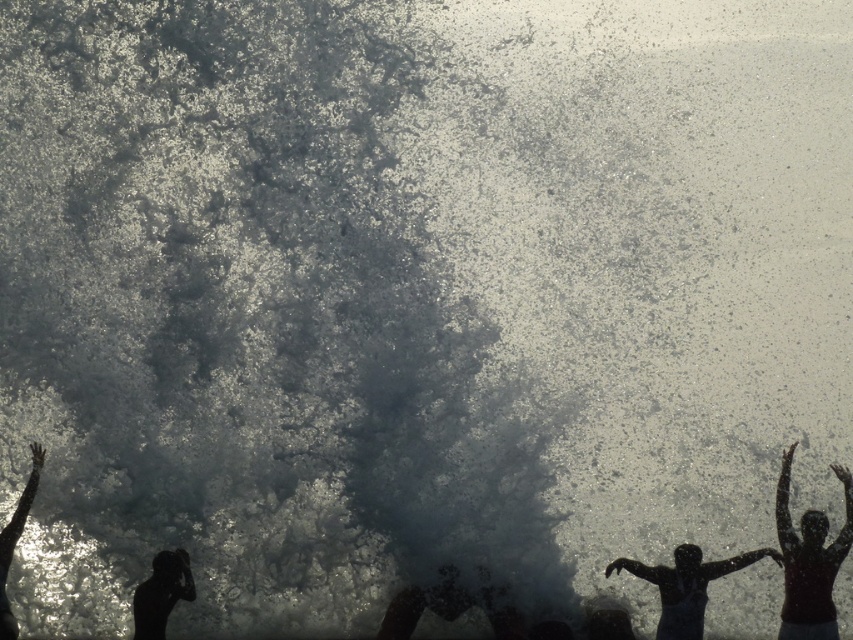
You are a photographer trying to capture the perfect shot of the wave and the people. Based on their sizes in the image, which silhouette human is closer to the camera, the silhouette human at lower right or the silhouette human at left?

The silhouette human at lower right is closer to the camera because it is wider than the silhouette human at left, indicating it occupies more space in the frame due to proximity.

You are a photographer trying to capture the perfect shot of the wave and the people. You want to ensure that both the silhouette human at lower right and the silhouette human at left are visible in the frame. Based on their positions, which direction should you adjust your camera to include both figures?

Since the silhouette human at lower right is to the right of the silhouette human at left, you should pan your camera slightly to the right to ensure both the silhouette human at lower right and the silhouette human at left are within the frame.